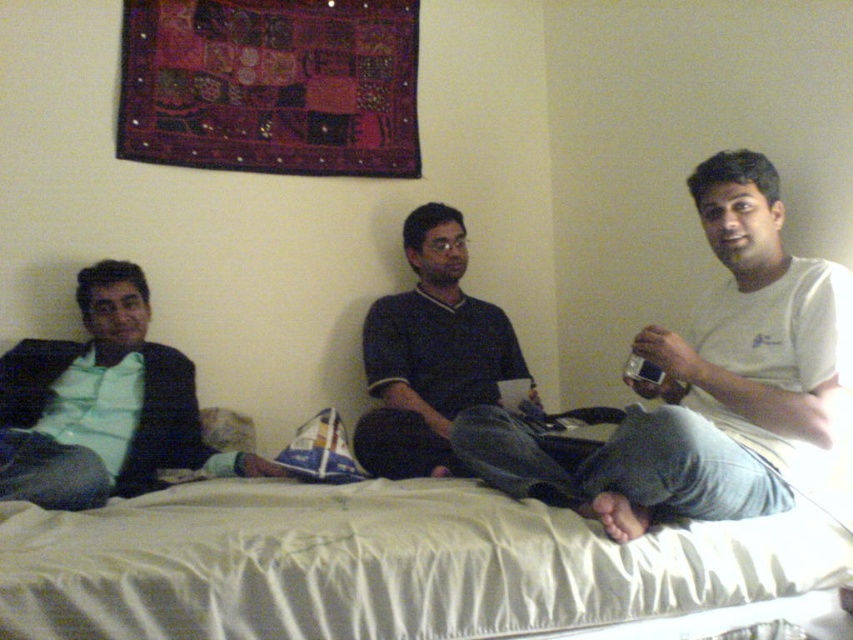
You are a photographer setting up a shoot in the room. You need to adjust the lighting so that the white cotton shirt at center and dark blue jersey at center are both well lit. Since the wall behind them is light beige, which might reflect some light, where should you place the main light to ensure both items are illuminated properly?

The white cotton shirt at center is located below dark blue jersey at center. To ensure both are well lit, place the main light above and slightly forward of the dark blue jersey at center so that the light can reach both the upper dark blue jersey and the lower white cotton shirt, utilizing the light beige wall to reflect and soften the illumination.